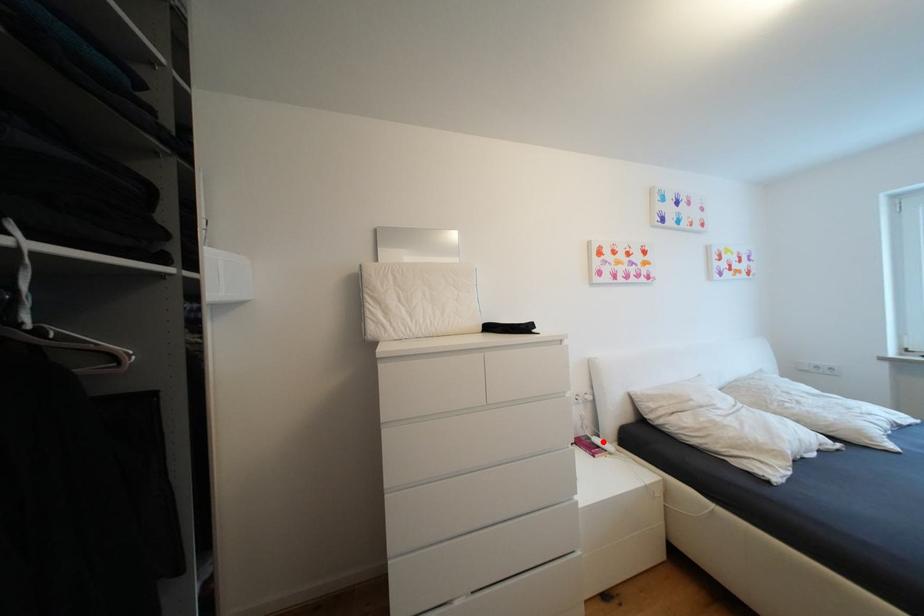
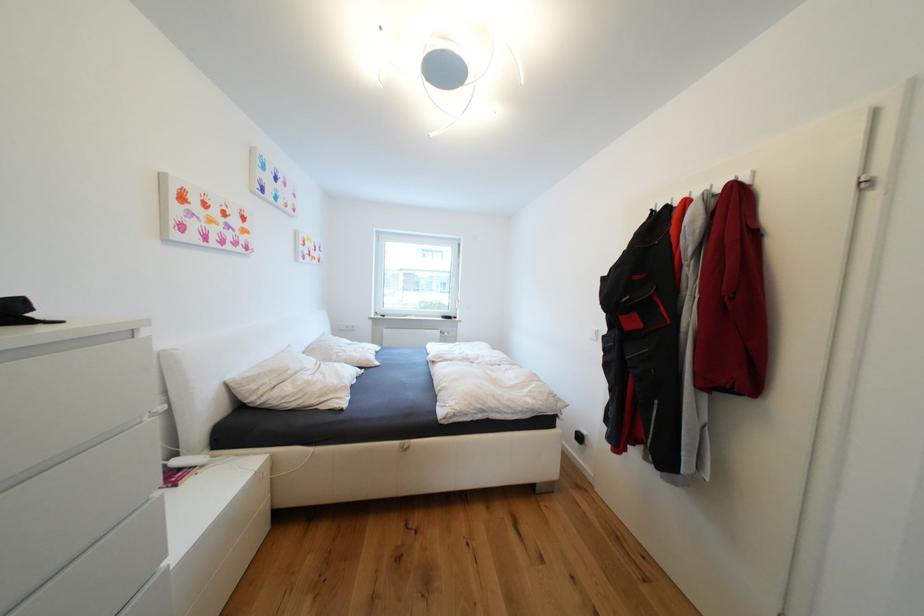
In the second image, find the point that corresponds to the highlighted location in the first image.

(184, 464)